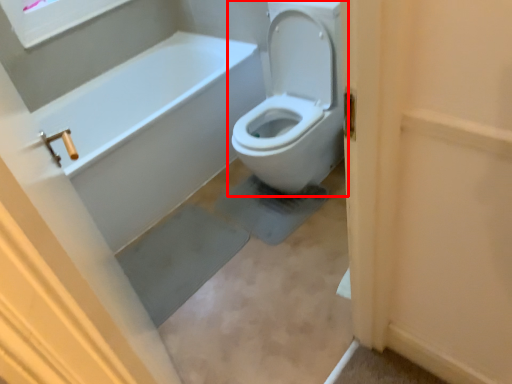
Question: From the image's perspective, what is the correct spatial positioning of toilet (annotated by the red box) in reference to screen door?

Choices:
 (A) above
 (B) below

Answer: (A)